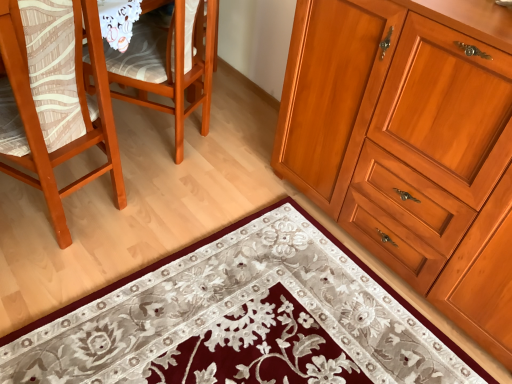
Question: Is wooden cabinet at right behind floral carpet at lower center?

Choices:
 (A) yes
 (B) no

Answer: (B)

Question: Is wooden cabinet at right positioned with its back to floral carpet at lower center?

Choices:
 (A) no
 (B) yes

Answer: (A)

Question: Considering the relative sizes of wooden cabinet at right and floral carpet at lower center in the image provided, is wooden cabinet at right wider than floral carpet at lower center?

Choices:
 (A) no
 (B) yes

Answer: (A)

Question: Is wooden cabinet at right bigger than floral carpet at lower center?

Choices:
 (A) no
 (B) yes

Answer: (B)

Question: Is wooden cabinet at right to the left of floral carpet at lower center from the viewer's perspective?

Choices:
 (A) yes
 (B) no

Answer: (B)

Question: Does wooden cabinet at right turn towards floral carpet at lower center?

Choices:
 (A) no
 (B) yes

Answer: (B)

Question: Can you confirm if wooden cabinet at right is smaller than wooden chair at left, the 1th chair viewed from the right?

Choices:
 (A) no
 (B) yes

Answer: (A)

Question: From the image's perspective, is wooden cabinet at right located beneath wooden chair at left, the 1th chair viewed from the right?

Choices:
 (A) no
 (B) yes

Answer: (B)

Question: Does wooden cabinet at right have a greater height compared to wooden chair at left, the 1th chair viewed from the right?

Choices:
 (A) yes
 (B) no

Answer: (A)

Question: Is wooden cabinet at right at the right side of wooden chair at left, the 1th chair viewed from the right?

Choices:
 (A) yes
 (B) no

Answer: (A)

Question: Is wooden cabinet at right positioned with its back to wooden chair at left, the 1th chair viewed from the right?

Choices:
 (A) yes
 (B) no

Answer: (B)

Question: Is wooden cabinet at right with wooden chair at left, the 1th chair viewed from the right?

Choices:
 (A) yes
 (B) no

Answer: (B)

Question: Is wooden chair at left, the 1th chair viewed from the right, closer to camera compared to matte wood chair at left, the second chair when ordered from right to left?

Choices:
 (A) yes
 (B) no

Answer: (B)